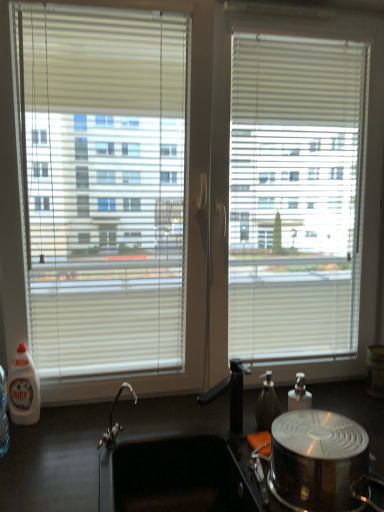
What do you see at coordinates (299, 395) in the screenshot?
I see `transparent plastic soap dispenser at center-right, which appears as the second bottle when viewed from the left` at bounding box center [299, 395].

In order to face white plastic bottle at left, which appears as the second bottle when viewed from the right, should I rotate leftwards or rightwards?

It's best to rotate left around 21.115 degrees.

At what (x,y) coordinates should I click in order to perform the action: click on white plastic bottle at left, placed as the first bottle when sorted from left to right. Please return your answer as a coordinate pair (x, y). This screenshot has width=384, height=512. Looking at the image, I should click on (23, 389).

I want to click on transparent plastic soap dispenser at center-right, which is the first bottle from right to left, so click(299, 395).

Looking at this image, is transparent plastic soap dispenser at center-right, which is the first bottle from right to left, taller than shiny metallic pot at lower right?

Yes.

Which is in front, point (291, 394) or point (329, 451)?

The point (329, 451) is closer.

Locate an element on the screen. bottle on the right of the shiny metallic pot at lower right is located at coordinates (299, 395).

Is transparent plastic soap dispenser at center-right, which appears as the second bottle when viewed from the left, with shiny metallic pot at lower right?

No, transparent plastic soap dispenser at center-right, which appears as the second bottle when viewed from the left, is not next to shiny metallic pot at lower right.

From the image's perspective, does shiny metallic pot at lower right appear lower than transparent plastic soap dispenser at center-right, which is the first bottle from right to left?

Correct, shiny metallic pot at lower right appears lower than transparent plastic soap dispenser at center-right, which is the first bottle from right to left, in the image.

Consider the image. How distant is shiny metallic pot at lower right from transparent plastic soap dispenser at center-right, which is the first bottle from right to left?

10.18 inches.

Is shiny metallic pot at lower right thinner than transparent plastic soap dispenser at center-right, which appears as the second bottle when viewed from the left?

In fact, shiny metallic pot at lower right might be wider than transparent plastic soap dispenser at center-right, which appears as the second bottle when viewed from the left.

Can you confirm if shiny metallic pot at lower right is shorter than transparent plastic soap dispenser at center-right, which is the first bottle from right to left?

Yes, shiny metallic pot at lower right is shorter than transparent plastic soap dispenser at center-right, which is the first bottle from right to left.

Can you see black matte countertop at lower center touching shiny metallic pot at lower right?

There is a gap between black matte countertop at lower center and shiny metallic pot at lower right.

From a real-world perspective, which object rests below the other?

In real-world perspective, black matte countertop at lower center is lower.

Would you say black matte countertop at lower center is to the left or to the right of shiny metallic pot at lower right in the picture?

black matte countertop at lower center is positioned on shiny metallic pot at lower right's left side.

Between black matte countertop at lower center and shiny metallic pot at lower right, which one has smaller size?

With smaller size is shiny metallic pot at lower right.

In the scene shown: Is shiny metallic pot at lower right to the right of white plastic bottle at left, which appears as the second bottle when viewed from the right, from the viewer's perspective?

Indeed, shiny metallic pot at lower right is positioned on the right side of white plastic bottle at left, which appears as the second bottle when viewed from the right.

Between shiny metallic pot at lower right and white plastic bottle at left, placed as the first bottle when sorted from left to right, which one has less height?

shiny metallic pot at lower right.

From the image's perspective, relative to white plastic bottle at left, placed as the first bottle when sorted from left to right, is shiny metallic pot at lower right above or below?

Based on their image positions, shiny metallic pot at lower right is located beneath white plastic bottle at left, placed as the first bottle when sorted from left to right.

Which of these two, black matte countertop at lower center or transparent plastic soap dispenser at center-right, which appears as the second bottle when viewed from the left, is wider?

With larger width is black matte countertop at lower center.

Considering the relative positions of black matte countertop at lower center and transparent plastic soap dispenser at center-right, which is the first bottle from right to left, in the image provided, is black matte countertop at lower center to the left or to the right of transparent plastic soap dispenser at center-right, which is the first bottle from right to left,?

From the image, it's evident that black matte countertop at lower center is to the left of transparent plastic soap dispenser at center-right, which is the first bottle from right to left.

From a real-world perspective, which is physically above, black matte countertop at lower center or transparent plastic soap dispenser at center-right, which is the first bottle from right to left?

transparent plastic soap dispenser at center-right, which is the first bottle from right to left, is physically above.

Considering the positions of objects black matte countertop at lower center and transparent plastic soap dispenser at center-right, which appears as the second bottle when viewed from the left, in the image provided, who is in front, black matte countertop at lower center or transparent plastic soap dispenser at center-right, which appears as the second bottle when viewed from the left,?

black matte countertop at lower center is closer to the camera.

In terms of width, does white plastic bottle at left, which appears as the second bottle when viewed from the right, look wider or thinner when compared to shiny metallic pot at lower right?

white plastic bottle at left, which appears as the second bottle when viewed from the right, is thinner than shiny metallic pot at lower right.

Is white plastic bottle at left, placed as the first bottle when sorted from left to right, at the right side of shiny metallic pot at lower right?

No.

Locate an element on the screen. bottle on the left of shiny metallic pot at lower right is located at coordinates (23, 389).

Between point (28, 398) and point (282, 441), which one is positioned in front?

The point (282, 441) is in front.

Which object is thinner, white plastic bottle at left, placed as the first bottle when sorted from left to right, or black matte countertop at lower center?

white plastic bottle at left, placed as the first bottle when sorted from left to right.

In the scene shown: Who is more distant, white plastic bottle at left, which appears as the second bottle when viewed from the right, or black matte countertop at lower center?

white plastic bottle at left, which appears as the second bottle when viewed from the right, is more distant.

Does white plastic bottle at left, which appears as the second bottle when viewed from the right, have a lesser height compared to black matte countertop at lower center?

Indeed, white plastic bottle at left, which appears as the second bottle when viewed from the right, has a lesser height compared to black matte countertop at lower center.

There is a shiny metallic pot at lower right. Where is `the 1st bottle above it (from the image's perspective)`? The image size is (384, 512). the 1st bottle above it (from the image's perspective) is located at coordinates (299, 395).

At what (x,y) coordinates should I click in order to perform the action: click on appliance on the left of transparent plastic soap dispenser at center-right, which is the first bottle from right to left. Please return your answer as a coordinate pair (x, y). Looking at the image, I should click on (317, 460).

Based on the photo, from the image, which object appears to be farther from white plastic bottle at left, placed as the first bottle when sorted from left to right, transparent plastic soap dispenser at center-right, which appears as the second bottle when viewed from the left, or shiny metallic pot at lower right?

shiny metallic pot at lower right lies further to white plastic bottle at left, placed as the first bottle when sorted from left to right, than the other object.

Looking at the image, which one is located closer to white plastic bottle at left, placed as the first bottle when sorted from left to right, shiny metallic pot at lower right or transparent plastic soap dispenser at center-right, which appears as the second bottle when viewed from the left?

Among the two, transparent plastic soap dispenser at center-right, which appears as the second bottle when viewed from the left, is located nearer to white plastic bottle at left, placed as the first bottle when sorted from left to right.

From the image, which object appears to be nearer to transparent plastic soap dispenser at center-right, which is the first bottle from right to left, shiny metallic pot at lower right or black matte countertop at lower center?

shiny metallic pot at lower right.

Estimate the real-world distances between objects in this image. Which object is further from shiny metallic pot at lower right, white plastic bottle at left, which appears as the second bottle when viewed from the right, or transparent plastic soap dispenser at center-right, which is the first bottle from right to left?

Based on the image, white plastic bottle at left, which appears as the second bottle when viewed from the right, appears to be further to shiny metallic pot at lower right.

Looking at the image, which one is located further to white plastic bottle at left, placed as the first bottle when sorted from left to right, shiny metallic pot at lower right or black matte countertop at lower center?

shiny metallic pot at lower right is further to white plastic bottle at left, placed as the first bottle when sorted from left to right.

From the picture: Estimate the real-world distances between objects in this image. Which object is closer to black matte countertop at lower center, white plastic bottle at left, which appears as the second bottle when viewed from the right, or transparent plastic soap dispenser at center-right, which is the first bottle from right to left?

white plastic bottle at left, which appears as the second bottle when viewed from the right, lies closer to black matte countertop at lower center than the other object.

Considering their positions, is transparent plastic soap dispenser at center-right, which is the first bottle from right to left, positioned closer to black matte countertop at lower center than shiny metallic pot at lower right?

The object closer to black matte countertop at lower center is shiny metallic pot at lower right.

From the picture: Estimate the real-world distances between objects in this image. Which object is further from black matte countertop at lower center, shiny metallic pot at lower right or white plastic bottle at left, placed as the first bottle when sorted from left to right?

shiny metallic pot at lower right.

Locate an element on the screen. The height and width of the screenshot is (512, 384). counter top between white plastic bottle at left, which appears as the second bottle when viewed from the right, and transparent plastic soap dispenser at center-right, which appears as the second bottle when viewed from the left, in the horizontal direction is located at coordinates (54, 461).

The image size is (384, 512). Find the location of `appliance positioned between black matte countertop at lower center and transparent plastic soap dispenser at center-right, which appears as the second bottle when viewed from the left, from near to far`. appliance positioned between black matte countertop at lower center and transparent plastic soap dispenser at center-right, which appears as the second bottle when viewed from the left, from near to far is located at coordinates pyautogui.click(x=317, y=460).

The width and height of the screenshot is (384, 512). What are the coordinates of `appliance situated between white plastic bottle at left, placed as the first bottle when sorted from left to right, and transparent plastic soap dispenser at center-right, which appears as the second bottle when viewed from the left, from left to right` in the screenshot? It's located at (317, 460).

Find the location of a particular element. counter top situated between white plastic bottle at left, which appears as the second bottle when viewed from the right, and shiny metallic pot at lower right from left to right is located at coordinates (54, 461).